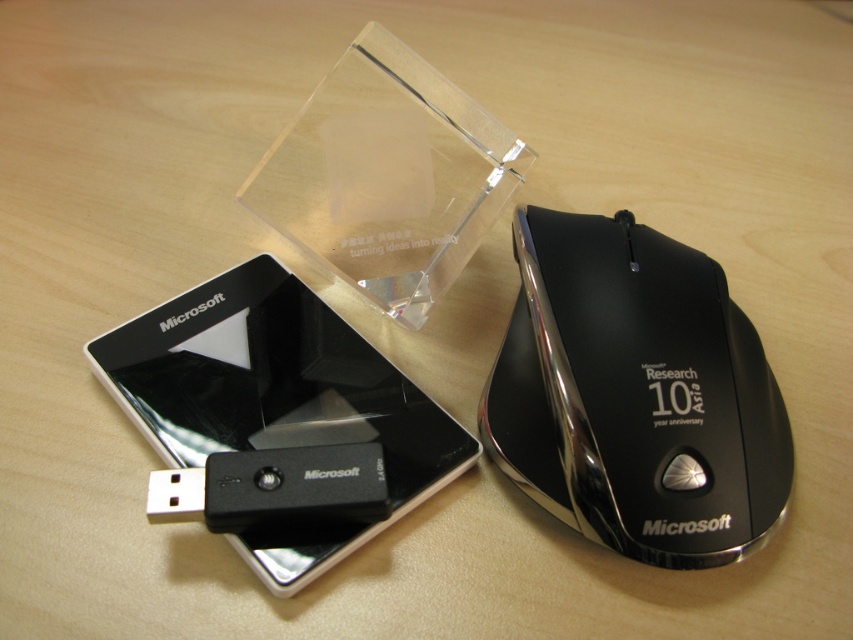
Does black glossy mouse at right have a larger size compared to black glossy smartphone at upper left?

No.

Measure the distance between black glossy mouse at right and black glossy smartphone at upper left.

black glossy mouse at right is 11.38 inches away from black glossy smartphone at upper left.

Between point (554, 376) and point (347, 348), which one is positioned behind?

The point (347, 348) is behind.

The width and height of the screenshot is (853, 640). In order to click on black glossy mouse at right in this screenshot , I will do `click(636, 394)`.